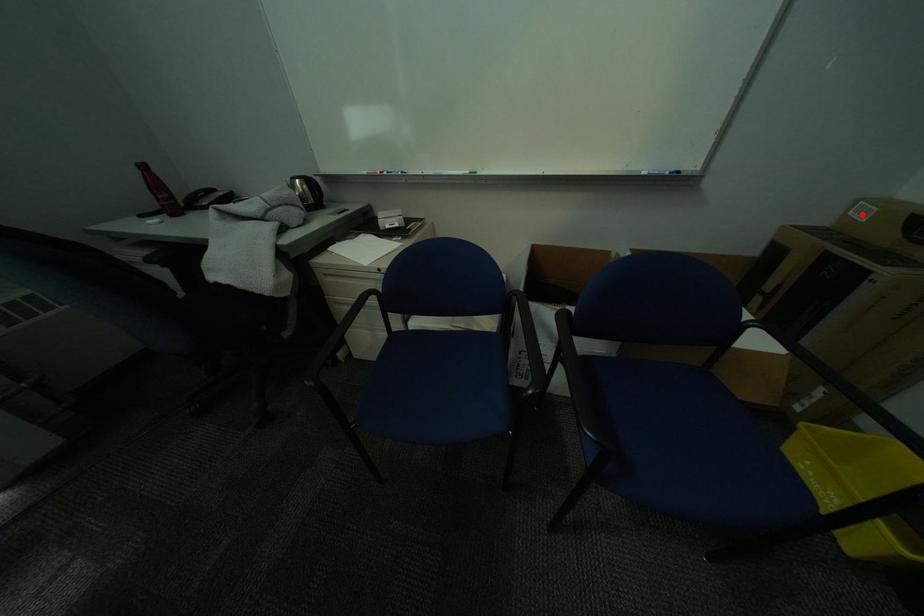
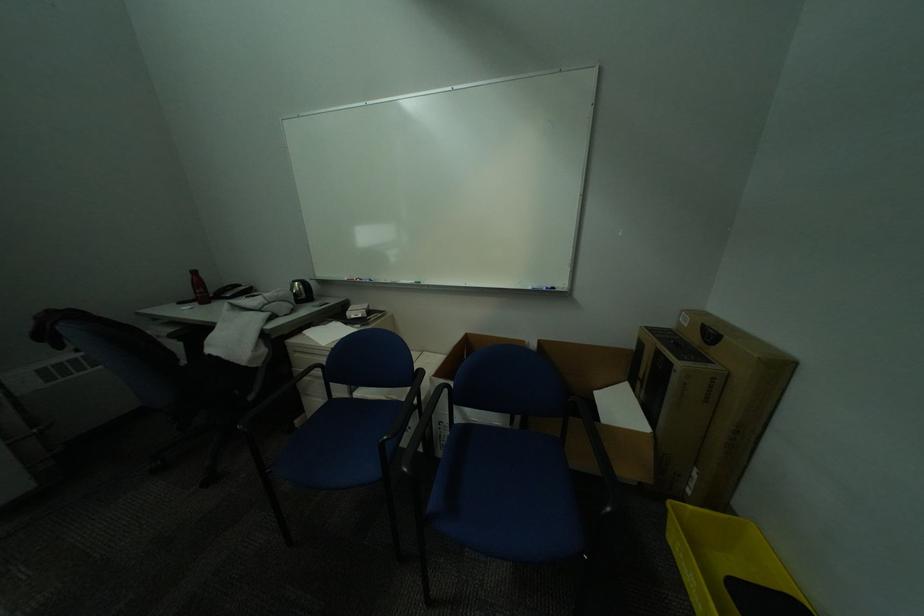
Question: I am providing you with two images of the same scene from different viewpoints. Image1 has a red point marked. In image2, the corresponding 3D location appears at what relative position? Reply with the corresponding letter.

Choices:
 (A) Closer
 (B) Farther

Answer: (A)